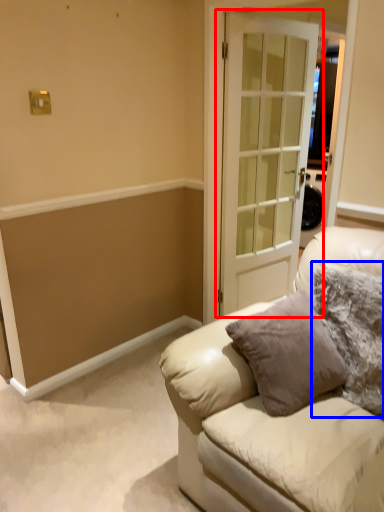
Question: Which object is further to the camera taking this photo, door (highlighted by a red box) or pillow (highlighted by a blue box)?

Choices:
 (A) door
 (B) pillow

Answer: (A)